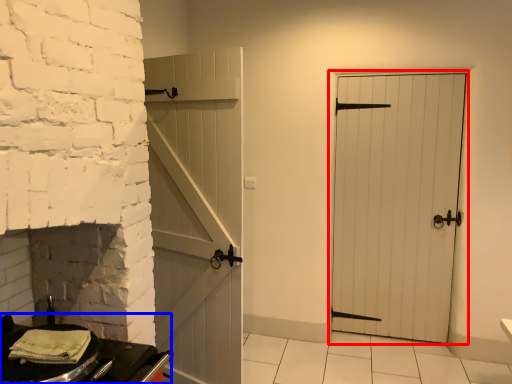
Question: Which of the following is the farthest to the observer, door (highlighted by a red box) or table (highlighted by a blue box)?

Choices:
 (A) door
 (B) table

Answer: (A)